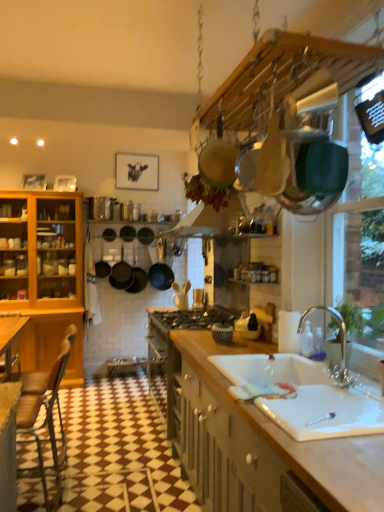
The image size is (384, 512). I want to click on free spot in front of chrome metallic faucet at sink right, so click(346, 396).